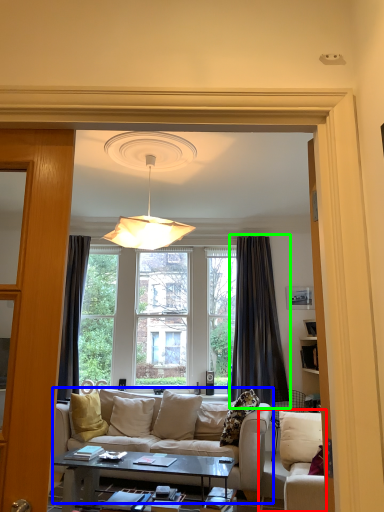
Question: Considering the real-world distances, which object is closest to studio couch (highlighted by a red box)? studio couch (highlighted by a blue box) or curtain (highlighted by a green box).

Choices:
 (A) studio couch
 (B) curtain

Answer: (A)